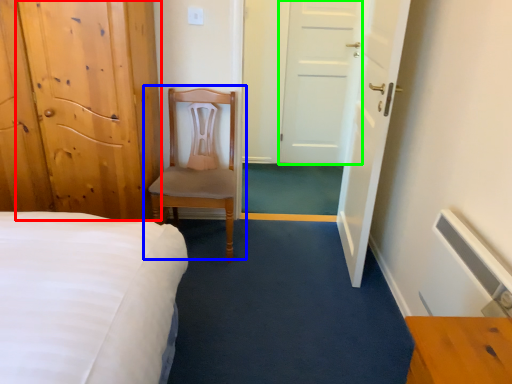
Question: Based on their relative distances, which object is nearer to door (highlighted by a red box)? Choose from chair (highlighted by a blue box) and door (highlighted by a green box).

Choices:
 (A) chair
 (B) door

Answer: (A)